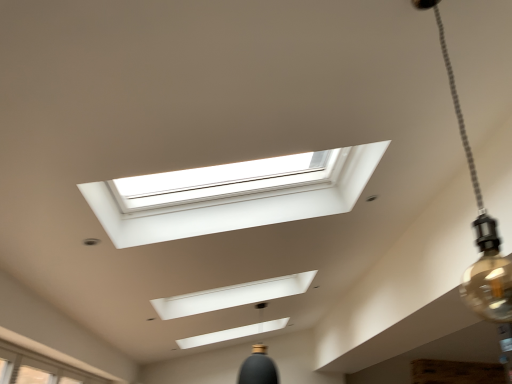
Question: From a real-world perspective, is white glass window at lower left over matte glass bulb at upper right?

Choices:
 (A) yes
 (B) no

Answer: (B)

Question: Considering the relative sizes of white glass window at lower left and matte glass bulb at upper right in the image provided, is white glass window at lower left wider than matte glass bulb at upper right?

Choices:
 (A) no
 (B) yes

Answer: (B)

Question: Is white glass window at lower left taller than matte glass bulb at upper right?

Choices:
 (A) no
 (B) yes

Answer: (A)

Question: Considering the relative positions of white glass window at lower left and matte glass bulb at upper right in the image provided, is white glass window at lower left to the right of matte glass bulb at upper right from the viewer's perspective?

Choices:
 (A) yes
 (B) no

Answer: (B)

Question: Considering the relative positions of white glass window at lower left and matte glass bulb at upper right in the image provided, is white glass window at lower left to the left of matte glass bulb at upper right from the viewer's perspective?

Choices:
 (A) yes
 (B) no

Answer: (A)

Question: Is white glass window at lower left facing away from matte glass bulb at upper right?

Choices:
 (A) no
 (B) yes

Answer: (A)

Question: Is matte glass bulb at upper right taller than white glass window at lower left?

Choices:
 (A) no
 (B) yes

Answer: (B)

Question: Can you confirm if matte glass bulb at upper right is positioned to the left of white glass window at lower left?

Choices:
 (A) no
 (B) yes

Answer: (A)

Question: Can you confirm if matte glass bulb at upper right is smaller than white glass window at lower left?

Choices:
 (A) yes
 (B) no

Answer: (A)

Question: Does matte glass bulb at upper right have a greater width compared to white glass window at lower left?

Choices:
 (A) no
 (B) yes

Answer: (A)

Question: Is the surface of matte glass bulb at upper right in direct contact with white glass window at lower left?

Choices:
 (A) yes
 (B) no

Answer: (B)

Question: Is matte glass bulb at upper right not within white glass window at lower left?

Choices:
 (A) no
 (B) yes

Answer: (B)

Question: Is matte glass bulb at upper right to the left or to the right of white glass window at lower left in the image?

Choices:
 (A) right
 (B) left

Answer: (A)